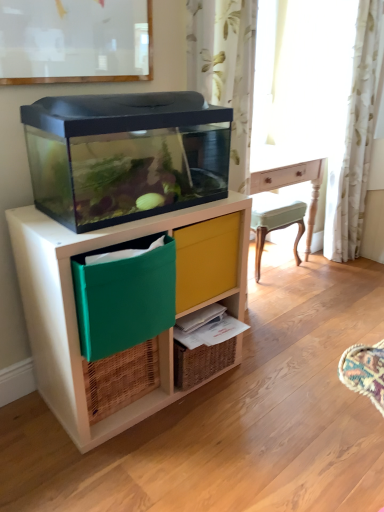
Question: Is yellow fabric drawer at center thinner than white floral fabric curtain at right?

Choices:
 (A) no
 (B) yes

Answer: (B)

Question: Does yellow fabric drawer at center have a greater width compared to white floral fabric curtain at right?

Choices:
 (A) no
 (B) yes

Answer: (A)

Question: Considering the relative positions of yellow fabric drawer at center and white floral fabric curtain at right in the image provided, is yellow fabric drawer at center in front of white floral fabric curtain at right?

Choices:
 (A) no
 (B) yes

Answer: (B)

Question: From the image's perspective, is yellow fabric drawer at center under white floral fabric curtain at right?

Choices:
 (A) yes
 (B) no

Answer: (A)

Question: Is yellow fabric drawer at center to the right of white floral fabric curtain at right from the viewer's perspective?

Choices:
 (A) no
 (B) yes

Answer: (A)

Question: Is yellow fabric drawer at center outside white floral fabric curtain at right?

Choices:
 (A) no
 (B) yes

Answer: (B)

Question: Is white floral fabric curtain at right completely or partially inside green fabric storage box at lower left?

Choices:
 (A) no
 (B) yes

Answer: (A)

Question: From the image's perspective, is green fabric storage box at lower left located above white floral fabric curtain at right?

Choices:
 (A) yes
 (B) no

Answer: (B)

Question: Could you tell me if green fabric storage box at lower left is turned towards white floral fabric curtain at right?

Choices:
 (A) yes
 (B) no

Answer: (B)

Question: Is green fabric storage box at lower left positioned before white floral fabric curtain at right?

Choices:
 (A) no
 (B) yes

Answer: (B)

Question: Is green fabric storage box at lower left outside white floral fabric curtain at right?

Choices:
 (A) yes
 (B) no

Answer: (A)

Question: From a real-world perspective, is green fabric storage box at lower left physically above white floral fabric curtain at right?

Choices:
 (A) no
 (B) yes

Answer: (A)

Question: Is yellow fabric drawer at center looking in the opposite direction of woven wood shelf at lower center?

Choices:
 (A) no
 (B) yes

Answer: (A)